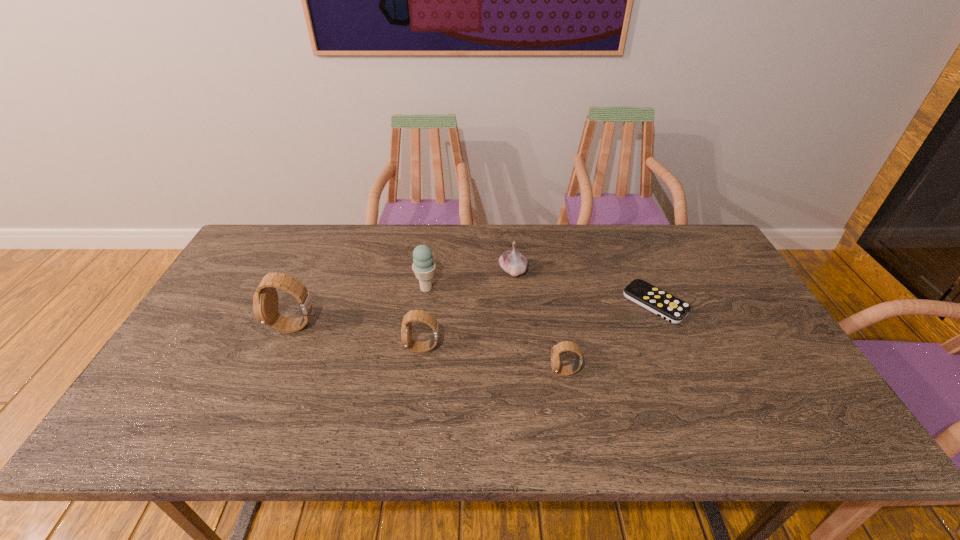
Find the location of `the closest object to the second tallest watch`. the closest object to the second tallest watch is located at coordinates (423, 266).

Select which object is the fifth closest to the third object from right to left. Please provide its 2D coordinates. Your answer should be formatted as a tuple, i.e. [(x, y)], where the tuple contains the x and y coordinates of a point satisfying the conditions above.

[(265, 300)]

This screenshot has width=960, height=540. I want to click on the closest watch to the second watch from left to right, so click(x=265, y=300).

You are a GUI agent. You are given a task and a screenshot of the screen. Output one action in this format:
    pyautogui.click(x=<x>, y=<y>)
    Task: Click on the watch object that ranks as the closest to the fifth object from left to right
    
    Given the screenshot: What is the action you would take?
    pyautogui.click(x=414, y=315)

Image resolution: width=960 pixels, height=540 pixels. Find the location of `vacant area that satisfies the following two spatial constraints: 1. on the front side of the ice cream; 2. on the left side of the remote control`. vacant area that satisfies the following two spatial constraints: 1. on the front side of the ice cream; 2. on the left side of the remote control is located at coordinates (424, 303).

Where is `free space that satisfies the following two spatial constraints: 1. on the front side of the ice cream; 2. on the face of the tallest watch`? This screenshot has width=960, height=540. free space that satisfies the following two spatial constraints: 1. on the front side of the ice cream; 2. on the face of the tallest watch is located at coordinates (421, 327).

Image resolution: width=960 pixels, height=540 pixels. What are the coordinates of `free location that satisfies the following two spatial constraints: 1. on the front side of the shortest object; 2. on the face of the nearest watch` in the screenshot? It's located at (684, 372).

Find the location of a particular element. blank area in the image that satisfies the following two spatial constraints: 1. on the front side of the shortest object; 2. on the face of the rightmost watch is located at coordinates (684, 372).